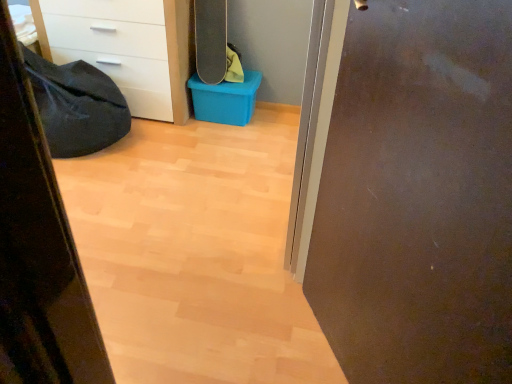
Question: Is matte brown door at right with blue plastic storage box at center?

Choices:
 (A) yes
 (B) no

Answer: (B)

Question: From a real-world perspective, is matte brown door at right located beneath blue plastic storage box at center?

Choices:
 (A) no
 (B) yes

Answer: (A)

Question: Would you say blue plastic storage box at center is part of matte brown door at right's contents?

Choices:
 (A) no
 (B) yes

Answer: (A)

Question: From the image's perspective, is matte brown door at right above blue plastic storage box at center?

Choices:
 (A) no
 (B) yes

Answer: (A)

Question: Is matte brown door at right far from blue plastic storage box at center?

Choices:
 (A) no
 (B) yes

Answer: (B)

Question: Would you say matte brown door at right is to the left or to the right of black fabric sleeping bag at left in the picture?

Choices:
 (A) right
 (B) left

Answer: (A)

Question: Relative to black fabric sleeping bag at left, is matte brown door at right in front or behind?

Choices:
 (A) front
 (B) behind

Answer: (A)

Question: From their relative heights in the image, would you say matte brown door at right is taller or shorter than black fabric sleeping bag at left?

Choices:
 (A) tall
 (B) short

Answer: (A)

Question: Is matte brown door at right situated inside black fabric sleeping bag at left or outside?

Choices:
 (A) outside
 (B) inside

Answer: (A)

Question: From the image's perspective, is black matte skateboard at upper center positioned above or below matte brown door at right?

Choices:
 (A) below
 (B) above

Answer: (B)

Question: Considering the positions of black matte skateboard at upper center and matte brown door at right in the image, is black matte skateboard at upper center wider or thinner than matte brown door at right?

Choices:
 (A) thin
 (B) wide

Answer: (B)

Question: From a real-world perspective, relative to matte brown door at right, is black matte skateboard at upper center vertically above or below?

Choices:
 (A) above
 (B) below

Answer: (B)

Question: Considering the positions of black matte skateboard at upper center and matte brown door at right in the image, is black matte skateboard at upper center taller or shorter than matte brown door at right?

Choices:
 (A) tall
 (B) short

Answer: (B)

Question: Is point (244, 119) closer or farther from the camera than point (210, 6)?

Choices:
 (A) closer
 (B) farther

Answer: (B)

Question: Based on their positions, is blue plastic storage box at center located to the left or right of black matte skateboard at upper center?

Choices:
 (A) left
 (B) right

Answer: (B)